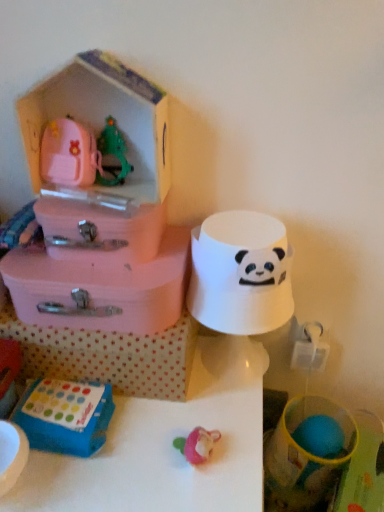
Question: Is pink plastic suitcase at left, the third storage box in the top-to-bottom sequence, positioned with its back to pink plastic storage box at upper left, the fourth storage box in the top-to-bottom sequence?

Choices:
 (A) no
 (B) yes

Answer: (A)

Question: Can you confirm if pink plastic suitcase at left, the third storage box in the top-to-bottom sequence, is positioned to the right of pink plastic storage box at upper left, the fourth storage box in the top-to-bottom sequence?

Choices:
 (A) no
 (B) yes

Answer: (A)

Question: Could you tell me if pink plastic suitcase at left, the third storage box in the top-to-bottom sequence, is turned towards pink plastic storage box at upper left, the fourth storage box in the top-to-bottom sequence?

Choices:
 (A) no
 (B) yes

Answer: (A)

Question: Can you confirm if pink plastic suitcase at left, the third storage box in the top-to-bottom sequence, is taller than pink plastic storage box at upper left, the fourth storage box in the top-to-bottom sequence?

Choices:
 (A) no
 (B) yes

Answer: (A)

Question: From the image's perspective, is pink plastic suitcase at left, the 2th storage box ordered from the bottom, located beneath pink plastic storage box at upper left, which appears as the 1th storage box when ordered from the bottom?

Choices:
 (A) no
 (B) yes

Answer: (A)

Question: Is point (105, 357) closer or farther from the camera than point (77, 414)?

Choices:
 (A) farther
 (B) closer

Answer: (A)

Question: Is pink plastic storage box at upper left, the fourth storage box in the top-to-bottom sequence, wider or thinner than blue plastic toy at lower left, the second toy positioned from the right?

Choices:
 (A) thin
 (B) wide

Answer: (B)

Question: Would you say pink plastic storage box at upper left, the fourth storage box in the top-to-bottom sequence, is to the left or to the right of blue plastic toy at lower left, positioned as the 2th toy in top-to-bottom order, in the picture?

Choices:
 (A) left
 (B) right

Answer: (B)

Question: Looking at the image, does pink plastic storage box at upper left, the fourth storage box in the top-to-bottom sequence, seem bigger or smaller compared to blue plastic toy at lower left, the second toy positioned from the right?

Choices:
 (A) small
 (B) big

Answer: (B)

Question: Does point (52, 261) appear closer or farther from the camera than point (33, 443)?

Choices:
 (A) farther
 (B) closer

Answer: (A)

Question: In terms of height, does pink plastic suitcase at left, the 2th storage box ordered from the bottom, look taller or shorter compared to blue plastic toy at lower left, placed as the first toy when sorted from bottom to top?

Choices:
 (A) short
 (B) tall

Answer: (B)

Question: Is pink plastic suitcase at left, the third storage box in the top-to-bottom sequence, wider or thinner than blue plastic toy at lower left, placed as the first toy when sorted from bottom to top?

Choices:
 (A) thin
 (B) wide

Answer: (B)

Question: From a real-world perspective, is pink plastic suitcase at left, the third storage box in the top-to-bottom sequence, positioned above or below blue plastic toy at lower left, positioned as the 2th toy in top-to-bottom order?

Choices:
 (A) above
 (B) below

Answer: (A)

Question: From a real-world perspective, is white matte table at center physically located above or below pink plastic suitcase at left, the 2th storage box ordered from the bottom?

Choices:
 (A) below
 (B) above

Answer: (A)

Question: Considering the positions of white matte table at center and pink plastic suitcase at left, the 2th storage box ordered from the bottom, in the image, is white matte table at center taller or shorter than pink plastic suitcase at left, the 2th storage box ordered from the bottom,?

Choices:
 (A) short
 (B) tall

Answer: (B)